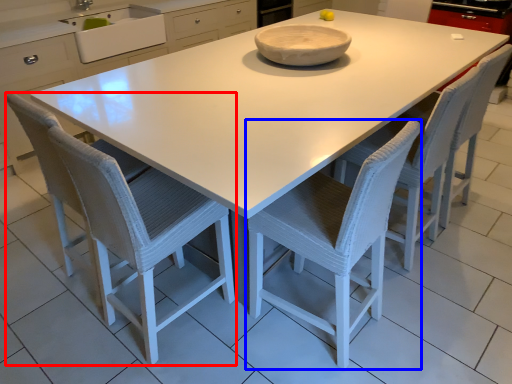
Question: Among these objects, which one is farthest to the camera, chair (highlighted by a red box) or chair (highlighted by a blue box)?

Choices:
 (A) chair
 (B) chair

Answer: (A)